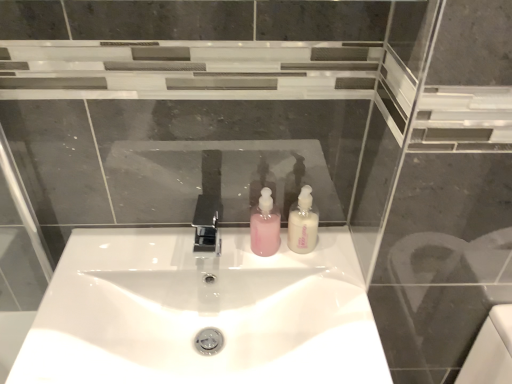
Question: Does white glossy sink at center have a greater width compared to polished chrome tap at center?

Choices:
 (A) yes
 (B) no

Answer: (A)

Question: Can you confirm if white glossy sink at center is positioned to the right of polished chrome tap at center?

Choices:
 (A) no
 (B) yes

Answer: (B)

Question: Can you confirm if white glossy sink at center is shorter than polished chrome tap at center?

Choices:
 (A) no
 (B) yes

Answer: (A)

Question: Is white glossy sink at center far away from polished chrome tap at center?

Choices:
 (A) yes
 (B) no

Answer: (B)

Question: From the image's perspective, is white glossy sink at center over polished chrome tap at center?

Choices:
 (A) yes
 (B) no

Answer: (B)

Question: Is white glossy sink at center bigger than polished chrome tap at center?

Choices:
 (A) yes
 (B) no

Answer: (A)

Question: From a real-world perspective, is white glossy sink at center positioned over white glossy soap dispenser at center, the first soap dispenser from the right, based on gravity?

Choices:
 (A) no
 (B) yes

Answer: (A)

Question: Is white glossy sink at center positioned behind white glossy soap dispenser at center, the 2th soap dispenser in the left-to-right sequence?

Choices:
 (A) no
 (B) yes

Answer: (A)

Question: Does white glossy sink at center have a greater height compared to white glossy soap dispenser at center, the first soap dispenser from the right?

Choices:
 (A) yes
 (B) no

Answer: (A)

Question: Is white glossy sink at center in front of white glossy soap dispenser at center, the first soap dispenser from the right?

Choices:
 (A) no
 (B) yes

Answer: (B)

Question: Would you say white glossy sink at center contains white glossy soap dispenser at center, the first soap dispenser from the right?

Choices:
 (A) no
 (B) yes

Answer: (A)

Question: From the image's perspective, would you say white glossy sink at center is shown under white glossy soap dispenser at center, the 2th soap dispenser in the left-to-right sequence?

Choices:
 (A) no
 (B) yes

Answer: (B)

Question: Considering the relative positions of polished chrome tap at center and white glossy soap dispenser at center, the first soap dispenser from the right, in the image provided, is polished chrome tap at center to the right of white glossy soap dispenser at center, the first soap dispenser from the right, from the viewer's perspective?

Choices:
 (A) no
 (B) yes

Answer: (A)